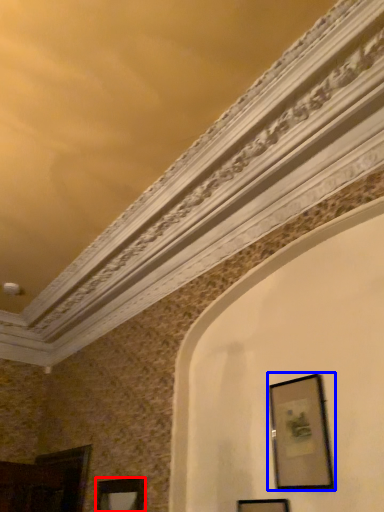
Question: Among these objects, which one is nearest to the camera, picture frame (highlighted by a red box) or picture frame (highlighted by a blue box)?

Choices:
 (A) picture frame
 (B) picture frame

Answer: (B)